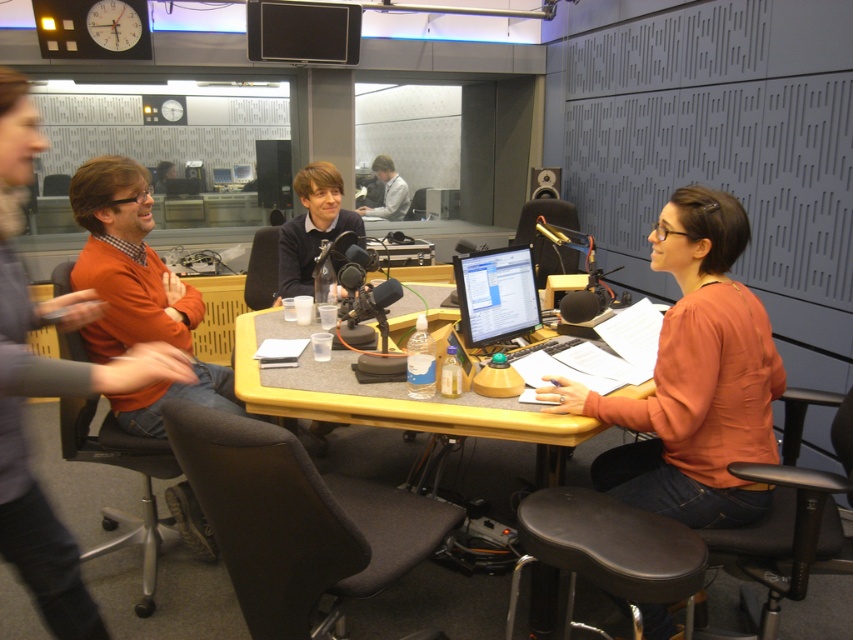
What do you see at coordinates (694, 378) in the screenshot? This screenshot has height=640, width=853. I see `orange fabric shirt at center` at bounding box center [694, 378].

Between orange fabric shirt at center and light gray shirt at center, which one has more height?

Standing taller between the two is orange fabric shirt at center.

This screenshot has width=853, height=640. In order to click on orange fabric shirt at center in this screenshot , I will do click(694, 378).

Is point (233, 490) less distant than point (196, 392)?

That is True.

Between dark gray fabric chair at center and orange sweater at left, which one appears on the left side from the viewer's perspective?

Positioned to the left is orange sweater at left.

Does point (340, 540) come behind point (172, 340)?

No, it is not.

This screenshot has height=640, width=853. I want to click on dark gray fabric chair at center, so click(296, 522).

Can you confirm if orange fabric shirt at center is wider than black leather stool at lower center?

Indeed, orange fabric shirt at center has a greater width compared to black leather stool at lower center.

Find the location of a particular element. Image resolution: width=853 pixels, height=640 pixels. orange fabric shirt at center is located at coordinates (694, 378).

Identify the location of orange fabric shirt at center. (694, 378).

Where is `orange fabric shirt at center`? orange fabric shirt at center is located at coordinates (694, 378).